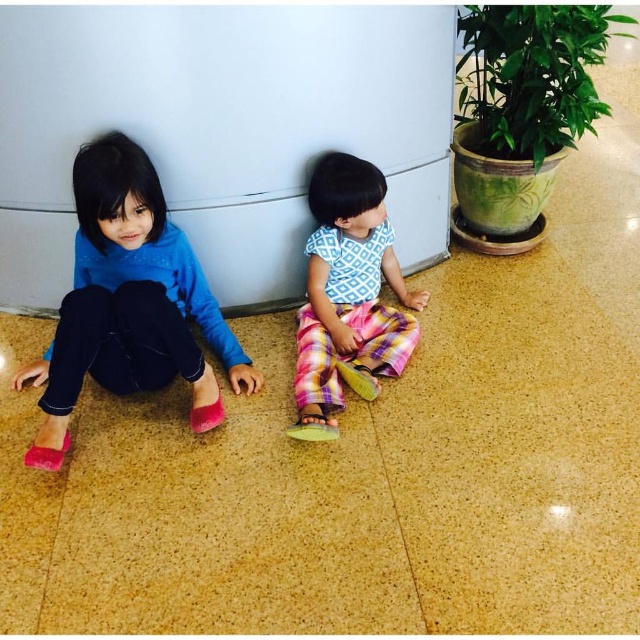
You are a parent looking for your child. You see the matte pink shoes at left and the plaid fabric pants at center. Which child is closer to the left side of the image?

The matte pink shoes at left are to the left of the plaid fabric pants at center, so the child wearing the matte pink shoes at left is closer to the left side of the image.

You are a parent trying to decide which item to pick up first. The matte pink shoes at left are taller than the plaid fabric pants at center. Which item is taller?

The matte pink shoes at left are taller than the plaid fabric pants at center.

You are standing at the origin point of the coordinate system in the image. The image has a coordinate system where the bottom left corner is the origin. You want to place a small toy at the location of the matte pink shoes at left. What are the coordinates where you should place the toy?

The coordinates for the matte pink shoes at left are at point (x=129, y=301).